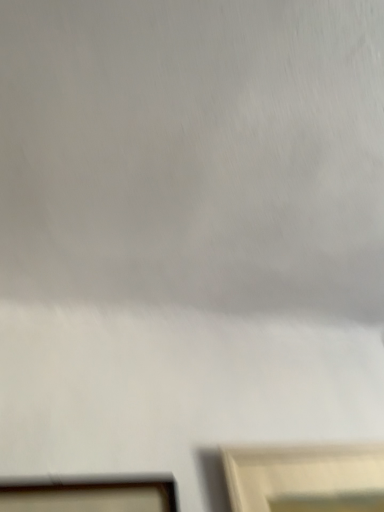
Image resolution: width=384 pixels, height=512 pixels. What do you see at coordinates (194, 154) in the screenshot?
I see `gray matte cloud at upper center` at bounding box center [194, 154].

Where is `gray matte cloud at upper center`? Image resolution: width=384 pixels, height=512 pixels. gray matte cloud at upper center is located at coordinates (194, 154).

The height and width of the screenshot is (512, 384). What are the coordinates of `gray matte cloud at upper center` in the screenshot? It's located at (194, 154).